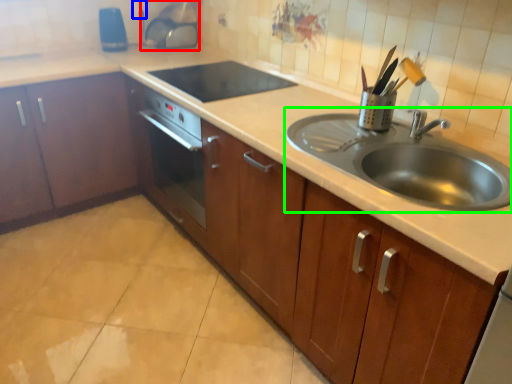
Question: Which object is positioned farthest from appliance (highlighted by a red box)? Select from electric outlet (highlighted by a blue box) and sink (highlighted by a green box).

Choices:
 (A) electric outlet
 (B) sink

Answer: (B)